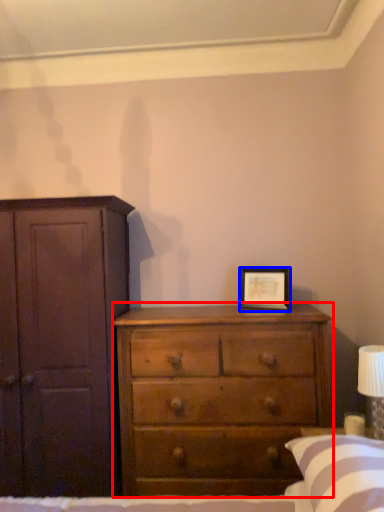
Question: Which object is closer to the camera taking this photo, chest of drawers (highlighted by a red box) or picture frame (highlighted by a blue box)?

Choices:
 (A) chest of drawers
 (B) picture frame

Answer: (A)